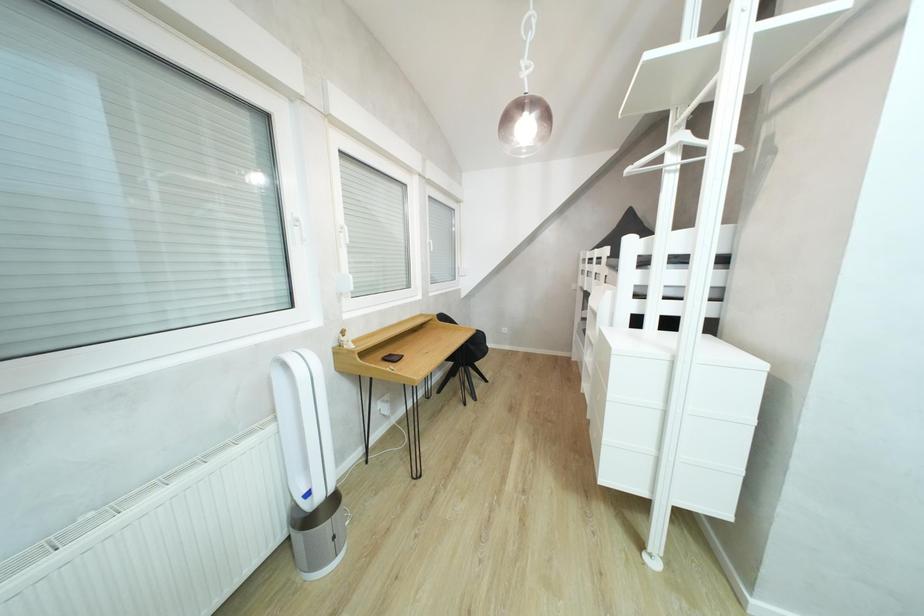
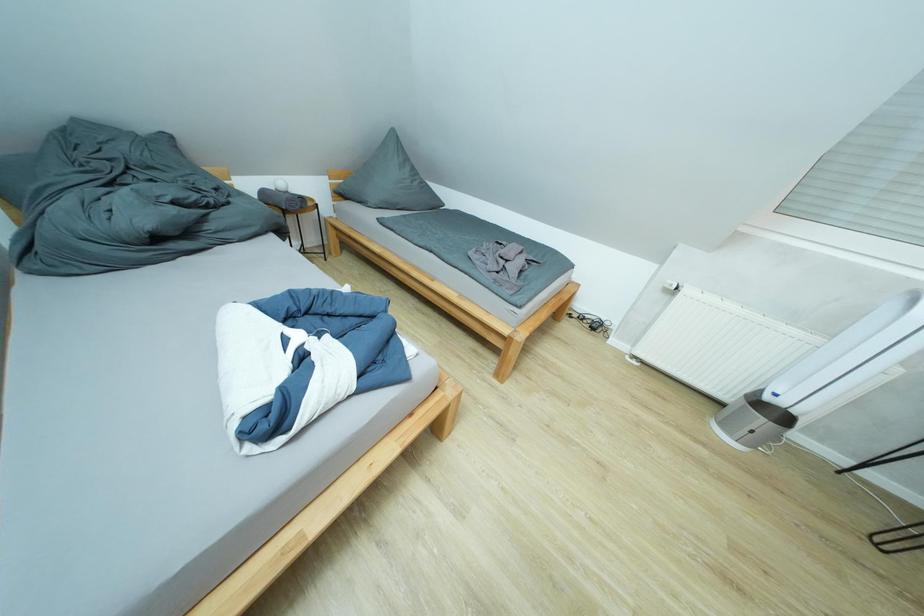
First-person continuous shooting, in which direction is the camera rotating?

The camera rotated toward left-down.